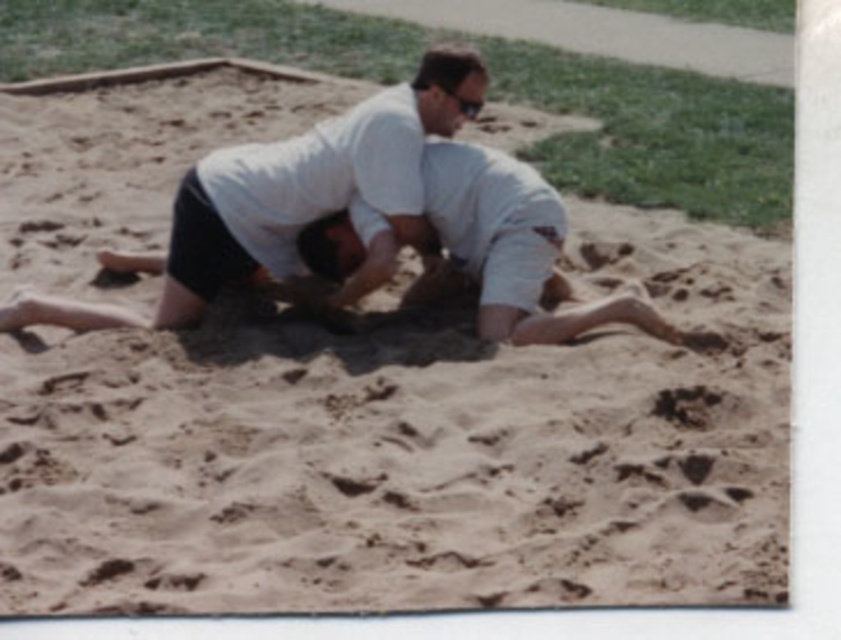
Question: Which point is closer to the camera taking this photo?

Choices:
 (A) pos(516,177)
 (B) pos(242,193)

Answer: (B)

Question: Can you confirm if white matte shirt at center is bigger than white cotton shirt at center?

Choices:
 (A) yes
 (B) no

Answer: (A)

Question: Which object appears closest to the camera in this image?

Choices:
 (A) white cotton shirt at center
 (B) white matte shirt at center

Answer: (A)

Question: Can you confirm if white matte shirt at center is bigger than white cotton shirt at center?

Choices:
 (A) no
 (B) yes

Answer: (B)

Question: In this image, where is white matte shirt at center located relative to white cotton shirt at center?

Choices:
 (A) above
 (B) below

Answer: (A)